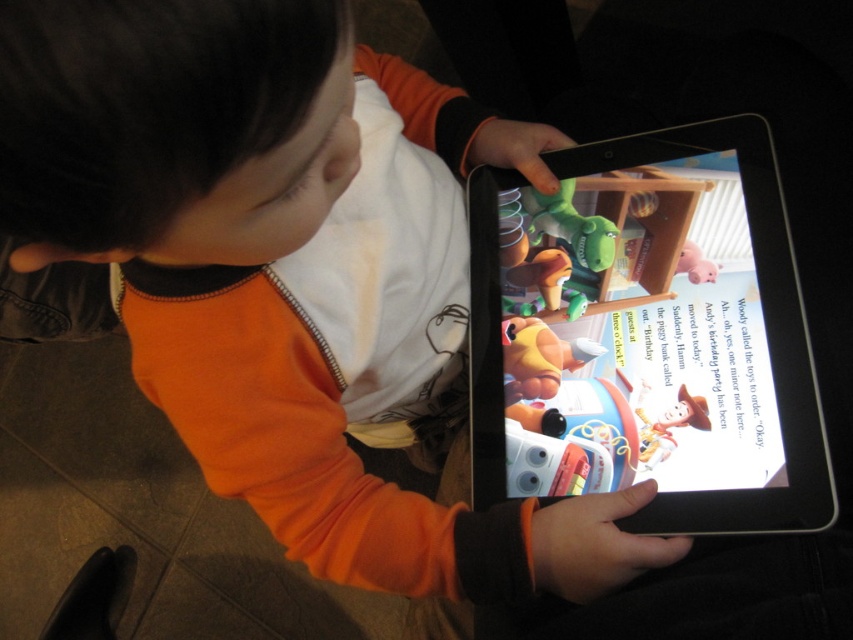
You are a child looking at the tablet screen. On the screen, there are a yellow rubber duck at center and a matte green plush dinosaur at center. Which one is on the left side?

The yellow rubber duck at center is on the left side of the matte green plush dinosaur at center.

You have a black plastic tablet at center and a pink rubber pig at upper right. Which object is wider?

The black plastic tablet at center is wider than the pink rubber pig at upper right.